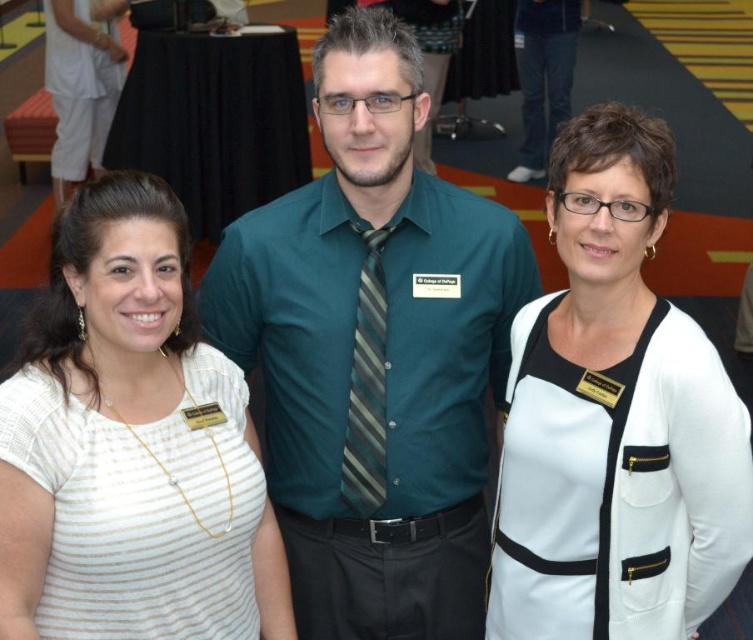
Question: Is teal shirt at center below white matte cardigan at center?

Choices:
 (A) yes
 (B) no

Answer: (B)

Question: Can you confirm if teal shirt at center is positioned to the right of white striped shirt at left?

Choices:
 (A) yes
 (B) no

Answer: (A)

Question: Which point is closer to the camera?

Choices:
 (A) teal shirt at center
 (B) white striped shirt at left
 (C) white matte cardigan at center

Answer: (B)

Question: Among these objects, which one is nearest to the camera?

Choices:
 (A) white matte cardigan at center
 (B) white striped shirt at left
 (C) teal shirt at center

Answer: (B)

Question: Is teal shirt at center to the left of white striped shirt at left from the viewer's perspective?

Choices:
 (A) yes
 (B) no

Answer: (B)

Question: Which point is closer to the camera taking this photo?

Choices:
 (A) (666, 452)
 (B) (11, 545)

Answer: (B)